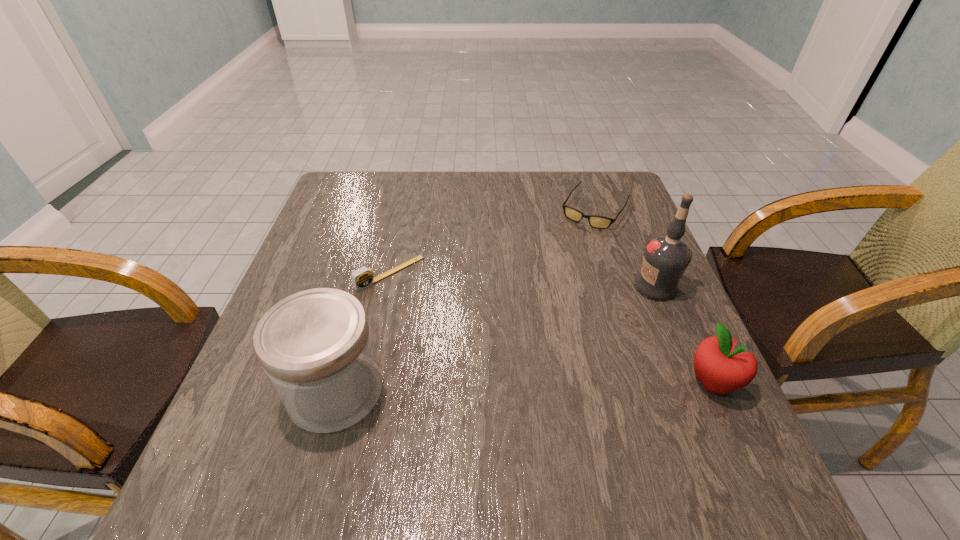
Find the location of a particular element. vacant spot on the desktop that is between the fourth shortest object and the third shortest object and is positioned on the front label of the vodka is located at coordinates (478, 388).

Where is `free space on the desktop that is between the fourth shortest object and the third shortest object and is positioned at the front of the tape measure with the tape extended`? free space on the desktop that is between the fourth shortest object and the third shortest object and is positioned at the front of the tape measure with the tape extended is located at coordinates (506, 387).

The width and height of the screenshot is (960, 540). I want to click on vacant space on the desktop that is between the jar and the apple and is positioned on the front-facing side of the sunglasses, so click(x=479, y=388).